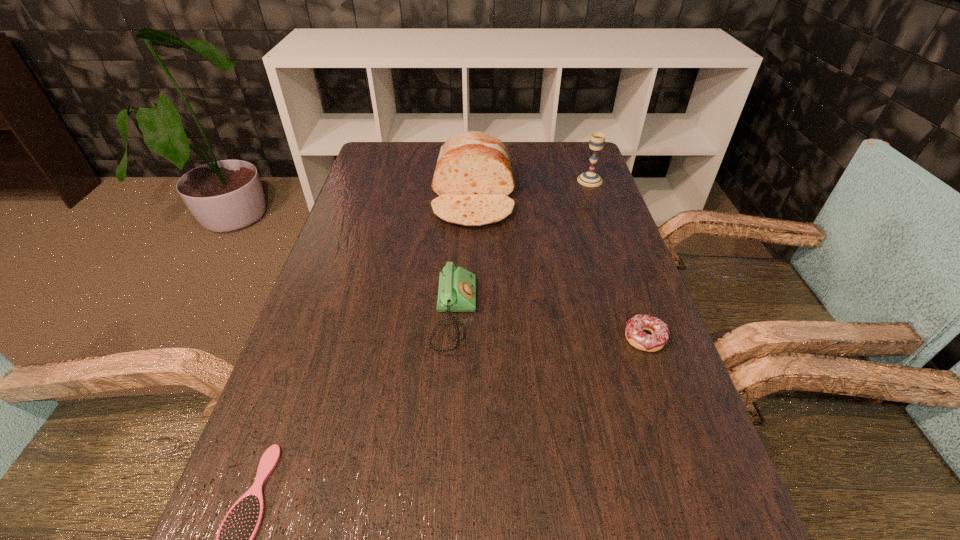
Where is `bread`? The image size is (960, 540). bread is located at coordinates (473, 178).

I want to click on chalice, so click(591, 179).

The height and width of the screenshot is (540, 960). In order to click on the third tallest object in this screenshot , I will do `click(457, 286)`.

The image size is (960, 540). What are the coordinates of `doughnut` in the screenshot? It's located at (634, 333).

Identify the location of vacant space located at the sliced end of the bread. The image size is (960, 540). (470, 347).

I want to click on vacant space situated 0.360m on the left of the chalice, so click(463, 180).

Locate an element on the screen. The image size is (960, 540). vacant space located on the dial of the telephone is located at coordinates (503, 315).

The image size is (960, 540). In order to click on blank space located 0.310m on the front of the second shortest object in this screenshot , I will do `click(708, 523)`.

This screenshot has height=540, width=960. I want to click on bread present at the far edge, so click(473, 178).

You are a GUI agent. You are given a task and a screenshot of the screen. Output one action in this format:
    pyautogui.click(x=<x>, y=<y>)
    Task: Click on the chalice at the far edge
    
    Given the screenshot: What is the action you would take?
    pyautogui.click(x=591, y=179)